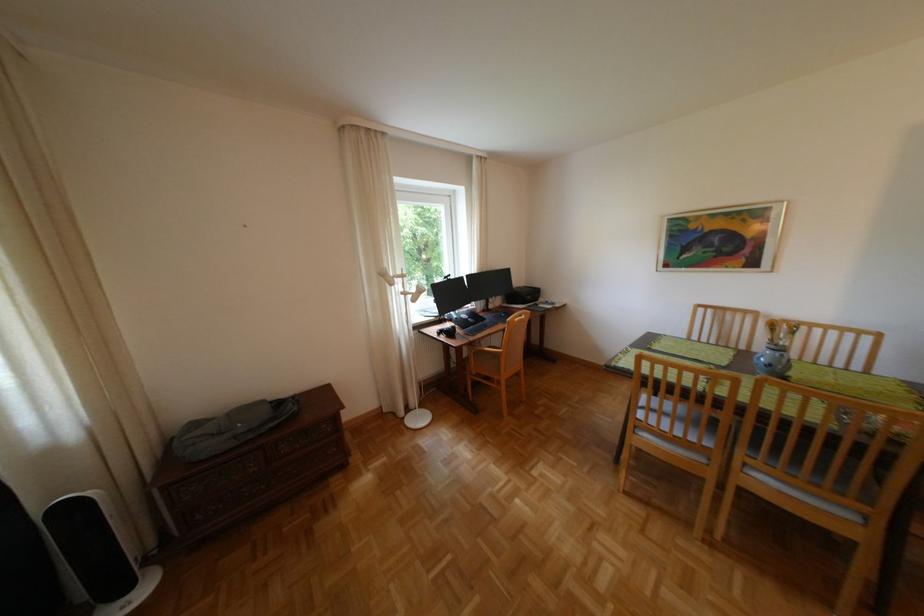
You are a GUI agent. You are given a task and a screenshot of the screen. Output one action in this format:
    pyautogui.click(x=<x>, y=<y>)
    Task: Click on the grey bag
    The image size is (924, 616).
    Given the screenshot: What is the action you would take?
    pyautogui.click(x=247, y=416)